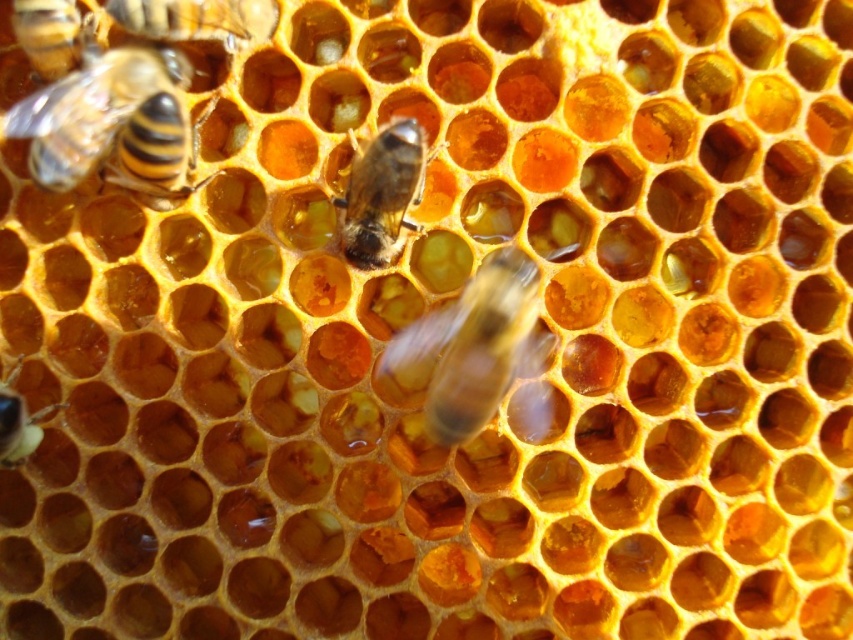
Looking at the honeycomb structure, where is the shiny golden honeycomb at center in relation to the translucent yellowish honeycomb at bottom left?

The shiny golden honeycomb at center is to the right of the translucent yellowish honeycomb at bottom left.

You are a beekeeper with a 50 cm long tool. You need to reach the shiny golden honeycomb at center from the translucent yellowish honeycomb at bottom left. Can your tool reach it?

The distance between the shiny golden honeycomb at center and the translucent yellowish honeycomb at bottom left is 52.87 centimeters. Since your tool is only 50 cm long, it cannot reach the shiny golden honeycomb at center from the translucent yellowish honeycomb at bottom left.

You are a beekeeper wearing a protective suit and holding a 1.0 meter long tool. You want to reach the point at coordinates point (457, 433) to collect honey. Given that your tool is 1.0 meters long, can you safely reach that point using your tool?

The point at coordinates point (457, 433) is 1.07 meters away from the camera. Since the tool is only 1.0 meters long, it is not long enough to reach the point. You will need a longer tool to safely collect honey from that location.